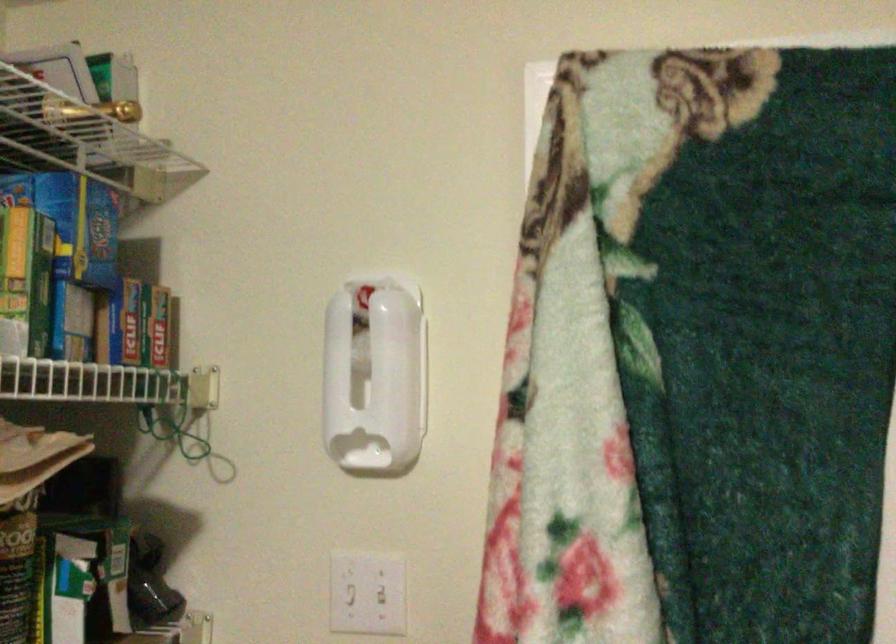
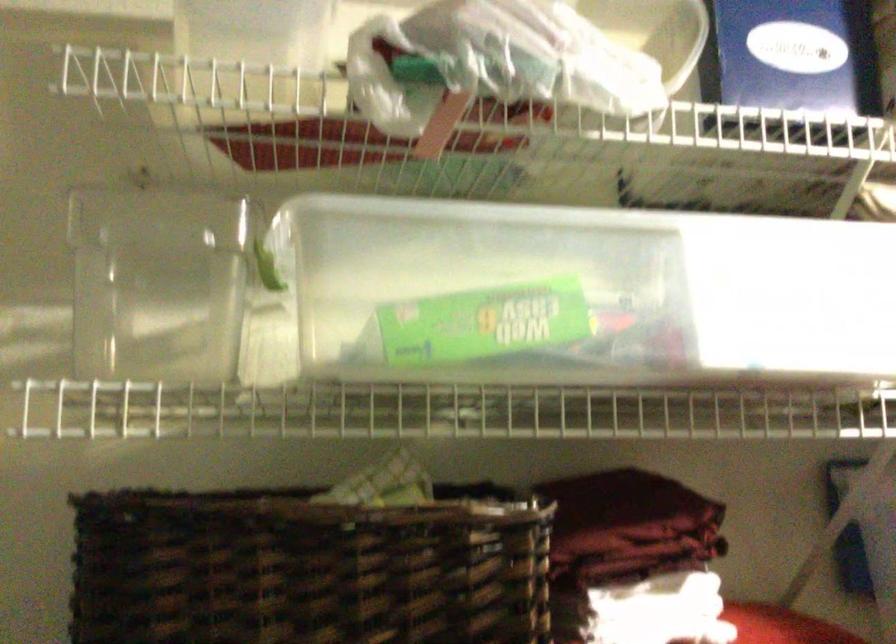
The first image is from the beginning of the video and the second image is from the end. How did the camera likely rotate when shooting the video?

The camera's rotation is toward right-up.